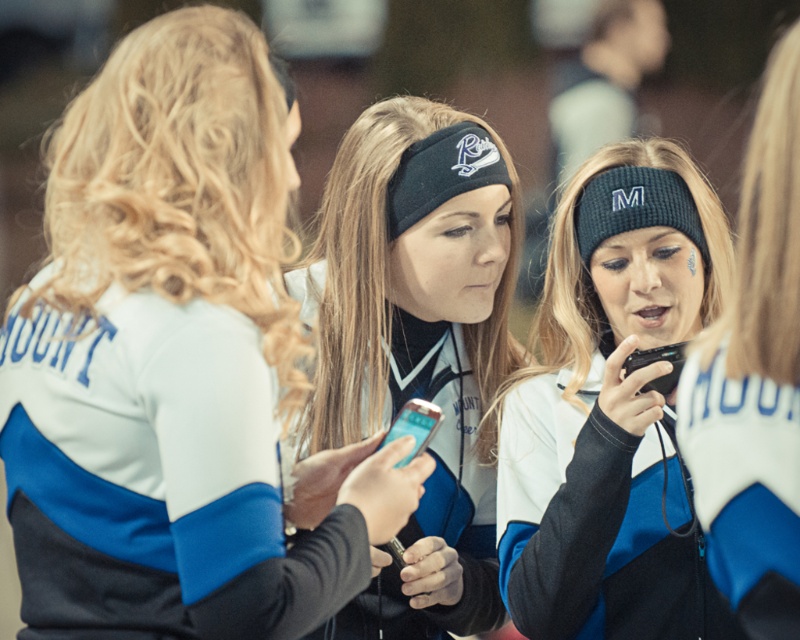
The height and width of the screenshot is (640, 800). What do you see at coordinates (414, 426) in the screenshot?
I see `metallic silver phone at center` at bounding box center [414, 426].

Which is below, metallic silver phone at center or black plastic phone at center?

metallic silver phone at center is below.

This screenshot has height=640, width=800. What are the coordinates of `metallic silver phone at center` in the screenshot? It's located at (414, 426).

Which is more to the right, black knit beanie at center or metallic silver phone at center?

From the viewer's perspective, black knit beanie at center appears more on the right side.

Does black knit beanie at center appear over metallic silver phone at center?

Indeed, black knit beanie at center is positioned over metallic silver phone at center.

This screenshot has height=640, width=800. Describe the element at coordinates (612, 410) in the screenshot. I see `black knit beanie at center` at that location.

Where is `black knit beanie at center`? The image size is (800, 640). black knit beanie at center is located at coordinates (612, 410).

Can you confirm if blue fleece beanie at center is positioned above metallic silver phone at center?

No, blue fleece beanie at center is not above metallic silver phone at center.

Does blue fleece beanie at center have a greater height compared to metallic silver phone at center?

Yes, blue fleece beanie at center is taller than metallic silver phone at center.

Is point (748, 611) positioned behind point (424, 410)?

No, (748, 611) is closer to viewer.

I want to click on blue fleece beanie at center, so click(754, 380).